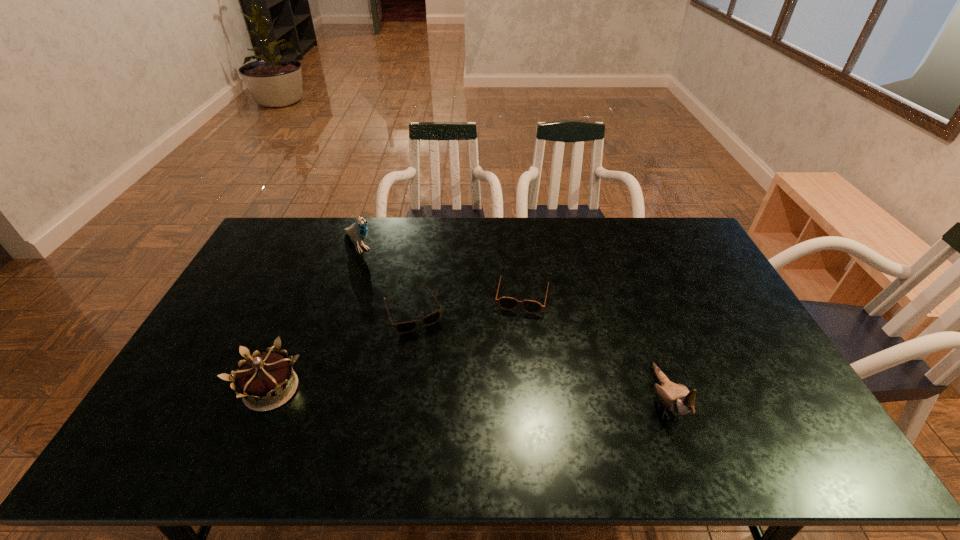
Find the location of a particular element. This screenshot has width=960, height=540. crown is located at coordinates (261, 380).

Where is `the nearer bird`? The image size is (960, 540). the nearer bird is located at coordinates (676, 397).

I want to click on the rightmost object, so click(676, 397).

Find the location of a particular element. Image resolution: width=960 pixels, height=540 pixels. the right sunglasses is located at coordinates (506, 303).

Identify the location of the fourth object from left to right. (506, 303).

Locate an element on the screen. Image resolution: width=960 pixels, height=540 pixels. the farthest object is located at coordinates (358, 230).

I want to click on the farther bird, so click(x=358, y=230).

What are the coordinates of `the left sunglasses` in the screenshot? It's located at (405, 327).

At what (x,y) coordinates should I click in order to perform the action: click on the shortest object. Please return your answer as a coordinate pair (x, y). Looking at the image, I should click on (405, 327).

This screenshot has width=960, height=540. I want to click on free space located 0.300m on the back of the third shortest object, so click(x=314, y=288).